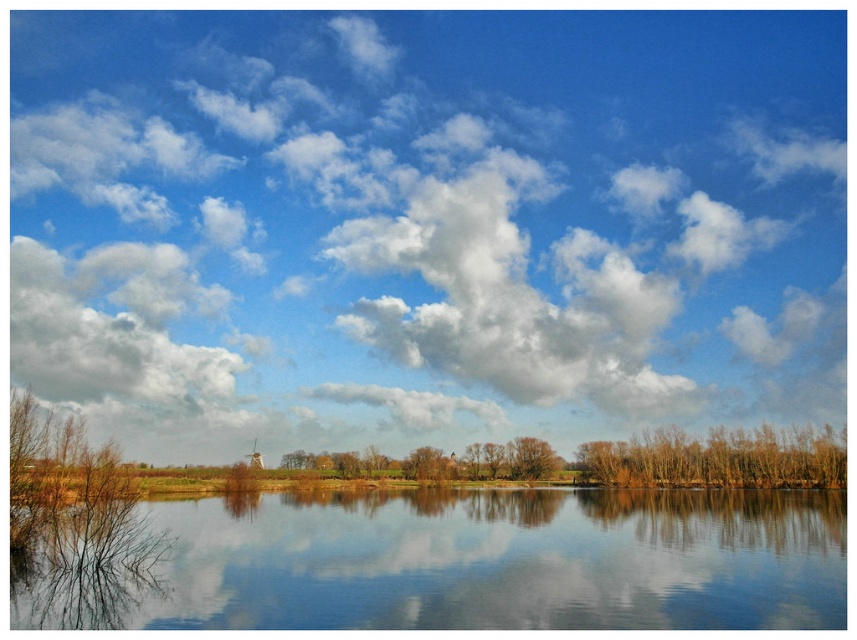
Does transparent glass water at center appear on the left side of brown matte trees at lower right?

Yes, transparent glass water at center is to the left of brown matte trees at lower right.

Locate an element on the screen. Image resolution: width=857 pixels, height=640 pixels. transparent glass water at center is located at coordinates (466, 563).

Is point (219, 618) positioned behind point (405, 406)?

No, it is not.

Is point (771, 490) in front of point (436, 396)?

Yes, it is.

Between point (588, 596) and point (348, 387), which one is positioned behind?

The point (348, 387) is behind.

The width and height of the screenshot is (857, 640). In order to click on transparent glass water at center in this screenshot , I will do `click(466, 563)`.

Describe the element at coordinates (426, 221) in the screenshot. This screenshot has width=857, height=640. I see `white fluffy cloud at upper center` at that location.

Between white fluffy cloud at upper center and brown matte tree at center, which one appears on the left side from the viewer's perspective?

white fluffy cloud at upper center

Between point (796, 362) and point (522, 468), which one is positioned in front?

Positioned in front is point (522, 468).

Locate an element on the screen. Image resolution: width=857 pixels, height=640 pixels. white fluffy cloud at upper center is located at coordinates point(426,221).